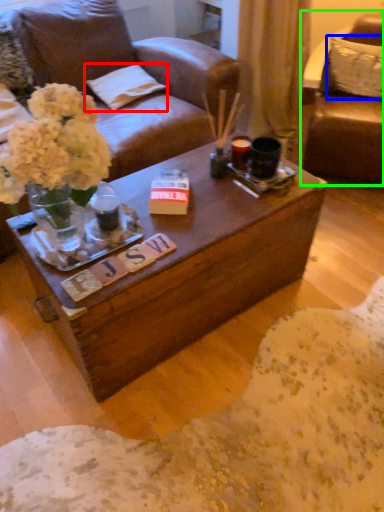
Question: Which is farther away from pillow (highlighted by a red box)? pillow (highlighted by a blue box) or chair (highlighted by a green box)?

Choices:
 (A) pillow
 (B) chair

Answer: (A)